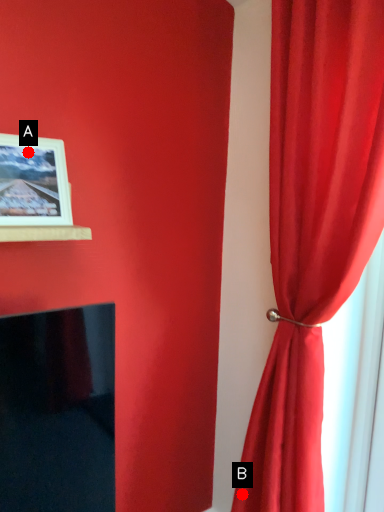
Question: Two points are circled on the image, labeled by A and B beside each circle. Which point is further to the camera?

Choices:
 (A) A is further
 (B) B is further

Answer: (B)